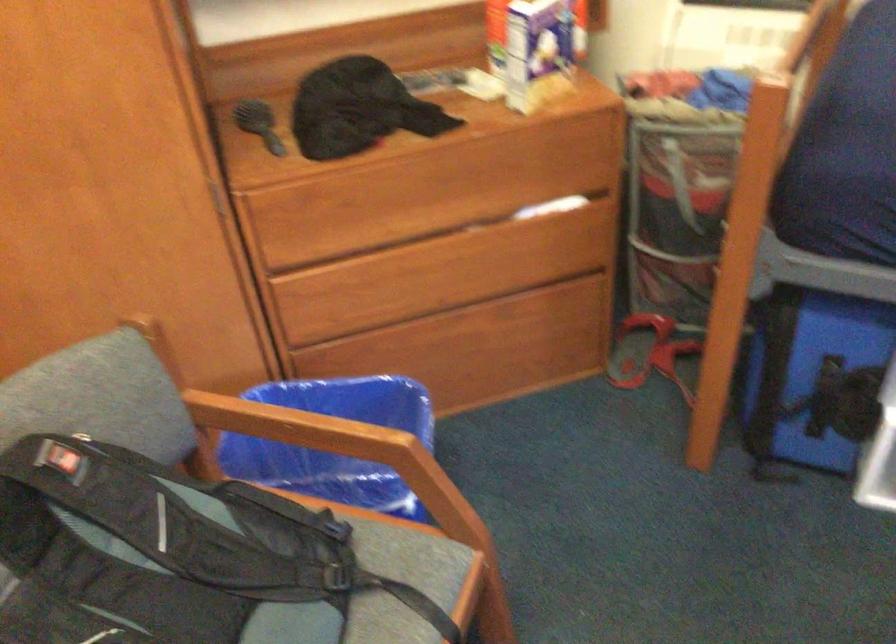
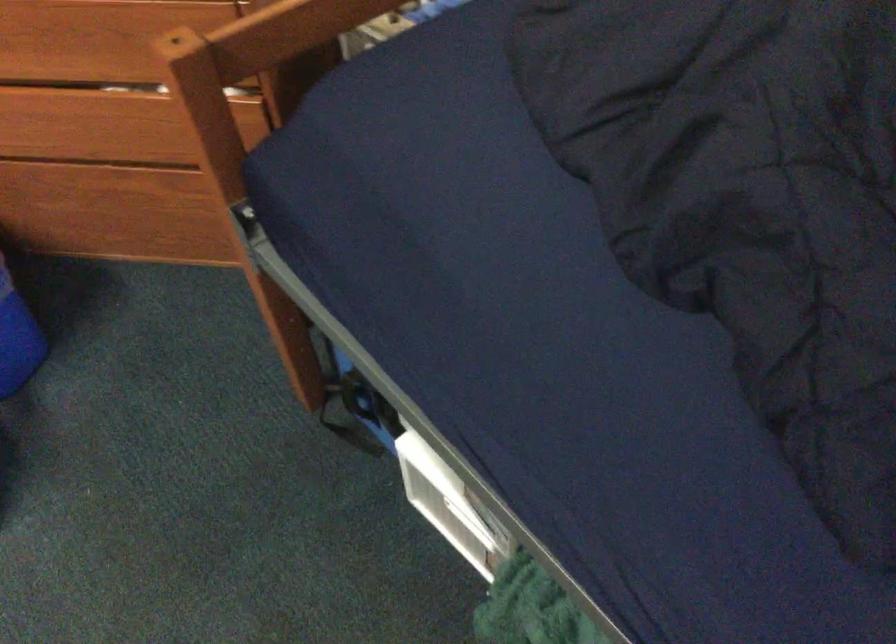
Question: The images are taken continuously from a first-person perspective. In which direction are you moving?

Choices:
 (A) Left
 (B) Right
 (C) Forward
 (D) Backward

Answer: (B)